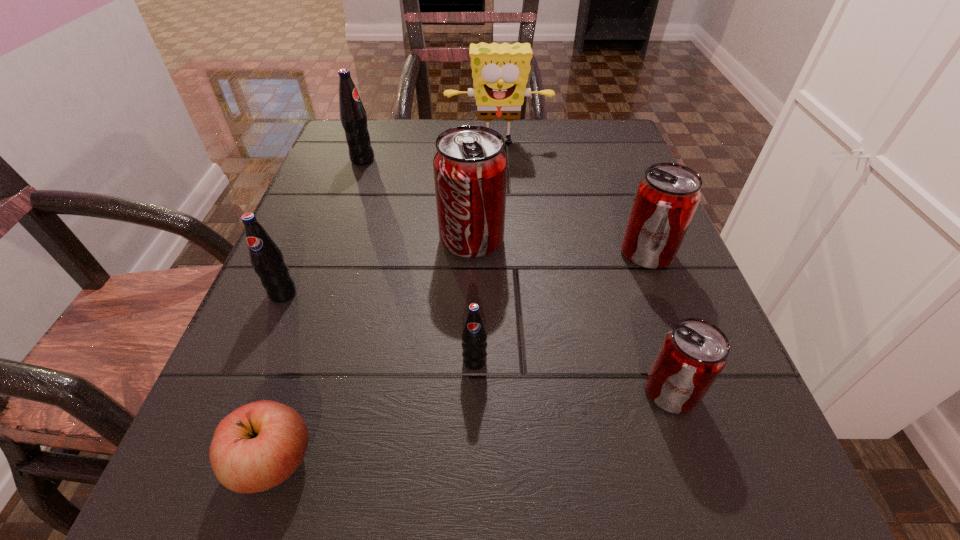
You are a GUI agent. You are given a task and a screenshot of the screen. Output one action in this format:
    pyautogui.click(x=<x>, y=<y>)
    Task: Click on the shortest object
    The width and height of the screenshot is (960, 540).
    Given the screenshot: What is the action you would take?
    pyautogui.click(x=259, y=445)

Locate an element on the screen. Image resolution: width=960 pixels, height=540 pixels. red apple is located at coordinates (259, 445).

You are a GUI agent. You are given a task and a screenshot of the screen. Output one action in this format:
    pyautogui.click(x=<x>, y=<y>)
    Task: Click on the vacant region located on the front-facing side of the sponge
    This screenshot has height=540, width=960.
    Given the screenshot: What is the action you would take?
    pyautogui.click(x=505, y=269)

This screenshot has height=540, width=960. I want to click on free region located on the front label of the farthest black pop, so click(x=510, y=160).

Find the location of a particular element. Image resolution: width=960 pixels, height=540 pixels. free space located on the back of the biggest red pop soda is located at coordinates (473, 170).

This screenshot has height=540, width=960. Find the location of `free location located 0.250m on the front label of the second nearest black pop`. free location located 0.250m on the front label of the second nearest black pop is located at coordinates (211, 467).

Locate an element on the screen. vacant space located 0.270m on the left of the second smallest red pop soda is located at coordinates (465, 253).

Locate an element on the screen. Image resolution: width=960 pixels, height=540 pixels. vacant space located on the left of the nearest red pop soda is located at coordinates (561, 392).

This screenshot has width=960, height=540. I want to click on free space located 0.190m on the front label of the nearest black pop, so click(x=473, y=525).

You are a GUI agent. You are given a task and a screenshot of the screen. Output one action in this format:
    pyautogui.click(x=<x>, y=<y>)
    Task: Click on the vacant space situated 0.300m on the right of the red apple
    The image size is (960, 540).
    Given the screenshot: What is the action you would take?
    pyautogui.click(x=570, y=461)